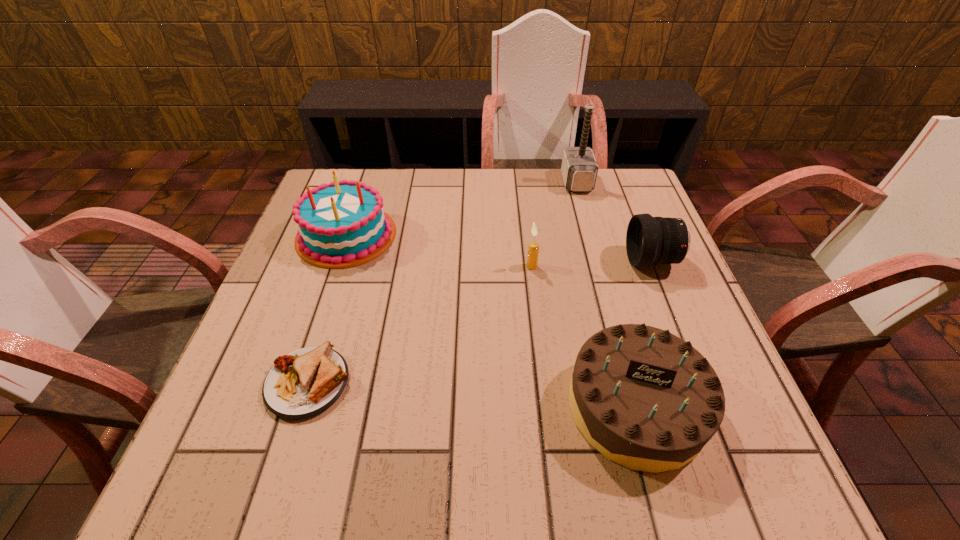
In order to click on object that is at the near edge in this screenshot , I will do `click(646, 399)`.

Locate an element on the screen. The height and width of the screenshot is (540, 960). birthday cake that is positioned at the left edge is located at coordinates (343, 224).

You are a GUI agent. You are given a task and a screenshot of the screen. Output one action in this format:
    pyautogui.click(x=<x>, y=<y>)
    Task: Click on the sandwich that is at the left edge
    Image resolution: width=960 pixels, height=540 pixels.
    Given the screenshot: What is the action you would take?
    pyautogui.click(x=306, y=382)

In order to click on hammer that is at the right edge in this screenshot , I will do `click(579, 168)`.

At what (x,y) coordinates should I click in order to perform the action: click on telephoto lens at the right edge. Please return your answer as a coordinate pair (x, y). The image size is (960, 540). Looking at the image, I should click on (650, 240).

The width and height of the screenshot is (960, 540). Find the location of `birthday cake situated at the right edge`. birthday cake situated at the right edge is located at coordinates (646, 399).

Where is `object at the far left corner`? object at the far left corner is located at coordinates (343, 224).

At what (x,y) coordinates should I click in order to perform the action: click on object at the far right corner. Please return your answer as a coordinate pair (x, y). This screenshot has width=960, height=540. Looking at the image, I should click on (579, 168).

You are a GUI agent. You are given a task and a screenshot of the screen. Output one action in this format:
    pyautogui.click(x=<x>, y=<y>)
    Task: Click on the object that is at the near right corner
    
    Given the screenshot: What is the action you would take?
    pyautogui.click(x=646, y=399)

At what (x,y) coordinates should I click in order to perform the action: click on free space at the far edge of the desktop. Please return your answer as a coordinate pair (x, y). Looking at the image, I should click on (431, 178).